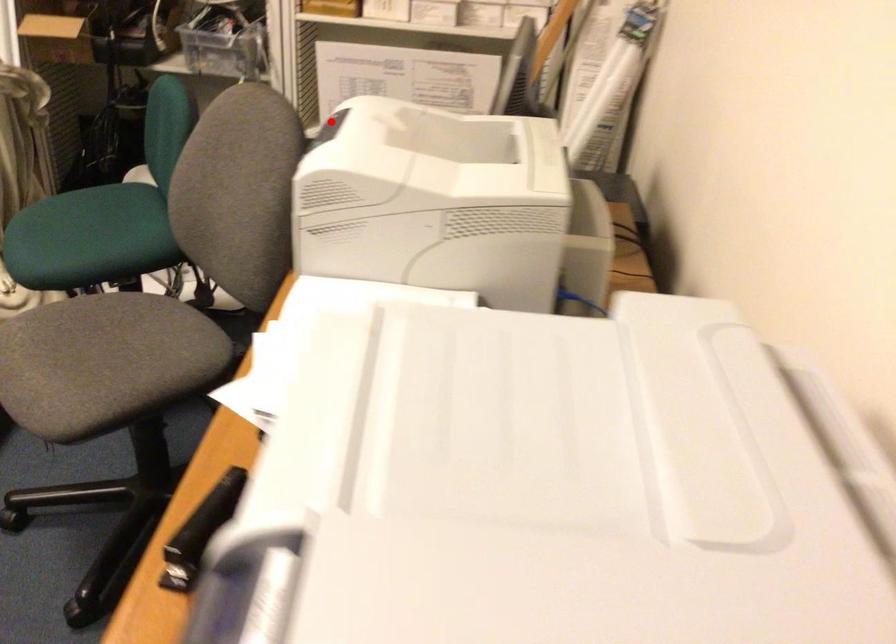
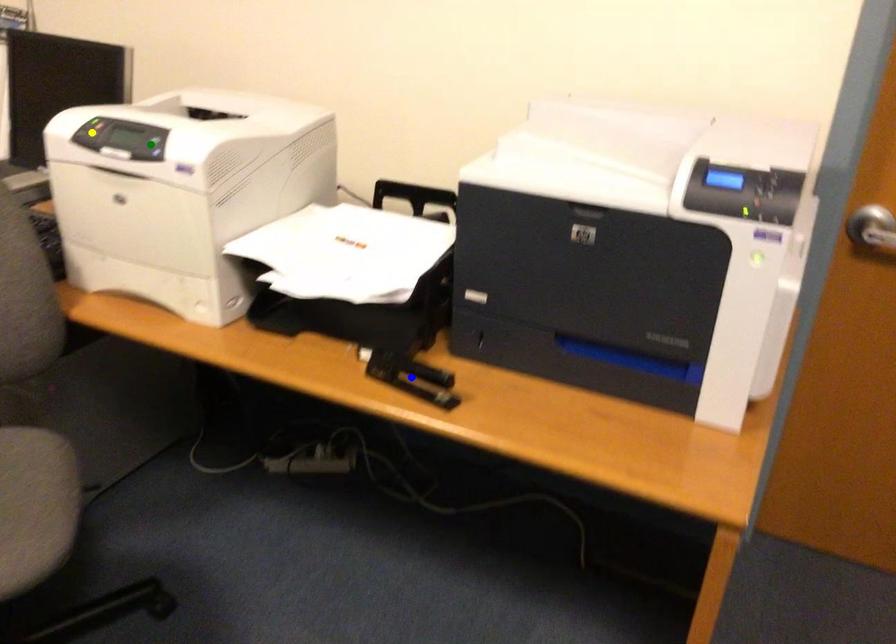
Question: I am providing you with two images of the same scene from different viewpoints. A red point is marked on the first image. You are given multiple points on the second image. In image 2, which mark is for the same physical point as the one in image 1?

Choices:
 (A) yellow point
 (B) blue point
 (C) green point

Answer: (A)